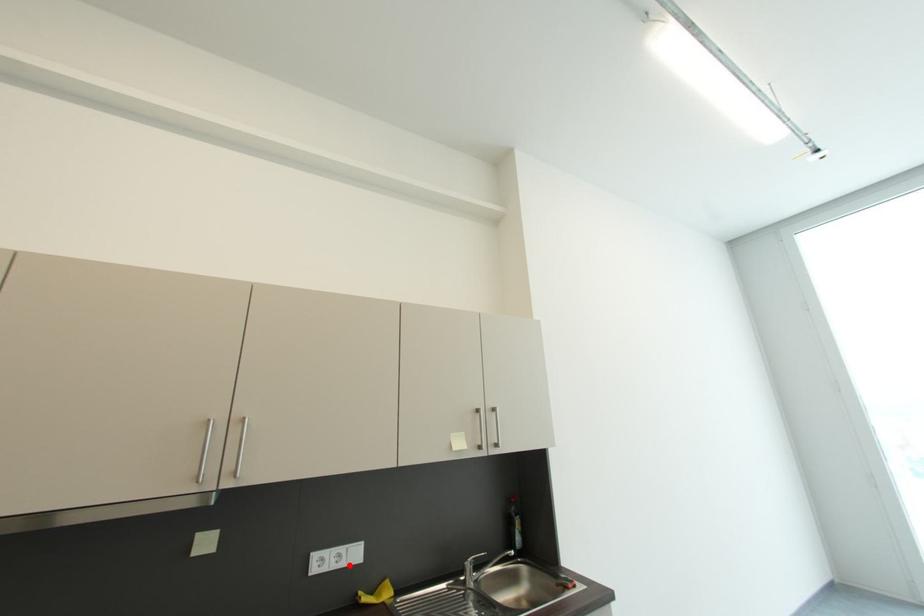
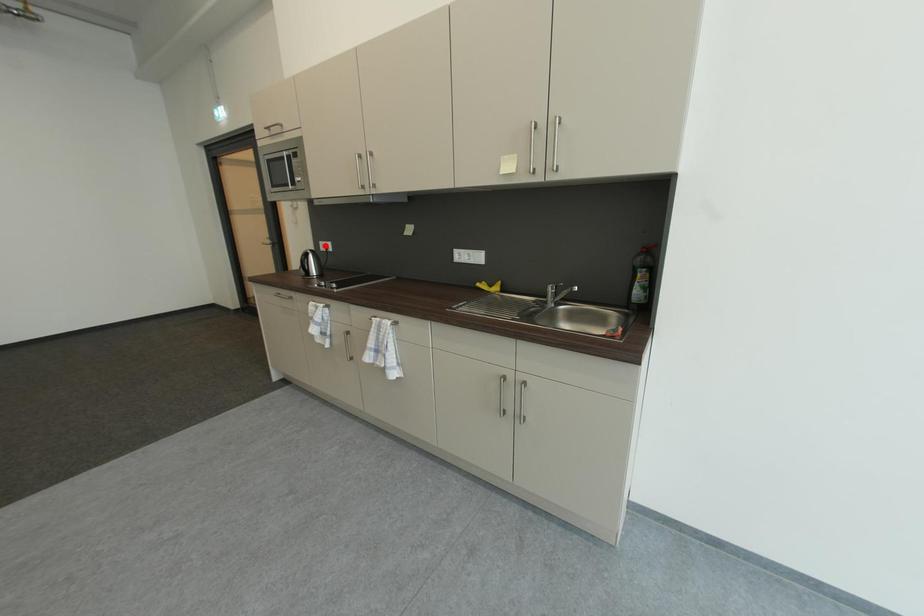
I am providing you with two images of the same scene from different viewpoints. A red point is marked on the first image and another point is marked on the second image. Is the red point in image1 aligned with the point shown in image2?

No